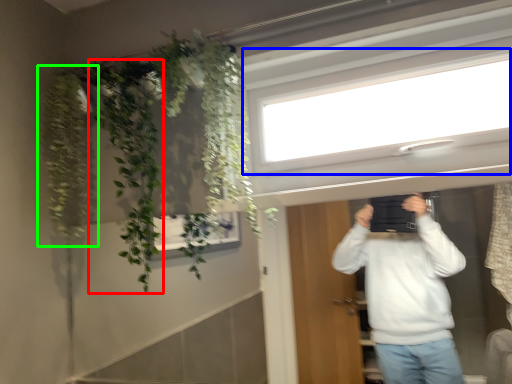
Question: Which is nearer to the plant (highlighted by a red box)? window (highlighted by a blue box) or plant (highlighted by a green box).

Choices:
 (A) window
 (B) plant

Answer: (B)